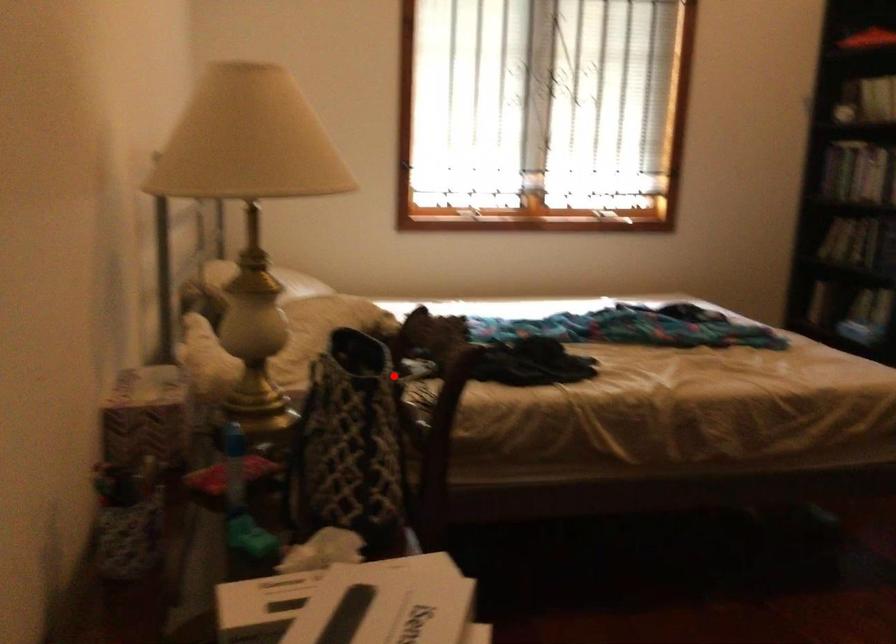
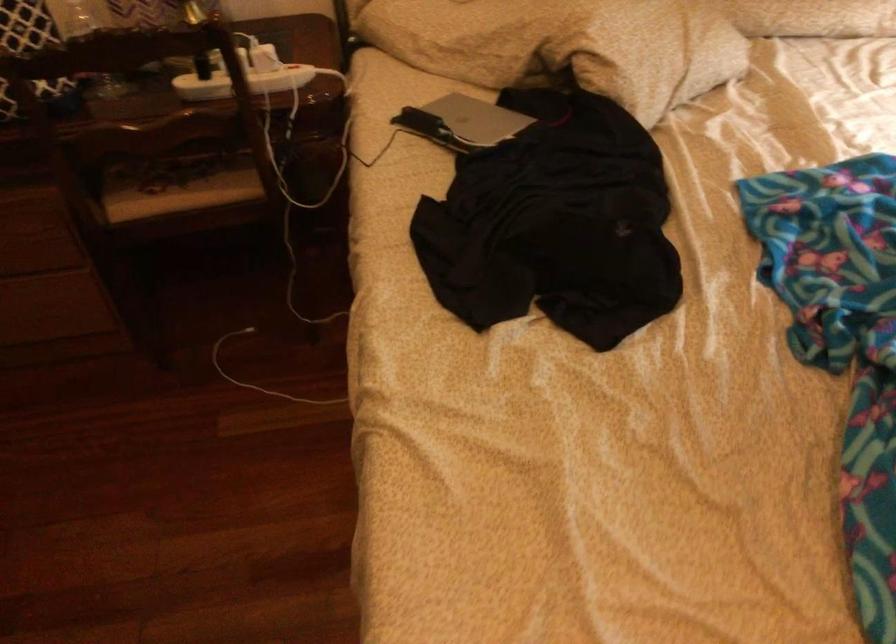
Question: I am providing you with two images of the same scene from different viewpoints. A red point is shown in image1. For the corresponding object point in image2, is it positioned nearer or farther from the camera?

Choices:
 (A) Nearer
 (B) Farther

Answer: (A)